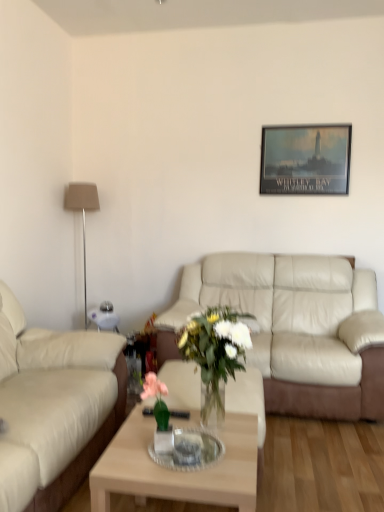
Question: Which direction should I rotate to look at beige leather couch at center, marked as the 1th studio couch in a right-to-left arrangement?

Choices:
 (A) right
 (B) left

Answer: (A)

Question: Is clear glass tray at center turned away from beige leather couch at left, which is counted as the first studio couch, starting from the front?

Choices:
 (A) no
 (B) yes

Answer: (B)

Question: Does clear glass tray at center have a larger size compared to beige leather couch at left, which is counted as the first studio couch, starting from the front?

Choices:
 (A) yes
 (B) no

Answer: (B)

Question: Does clear glass tray at center have a smaller size compared to beige leather couch at left, which is counted as the second studio couch, starting from the back?

Choices:
 (A) yes
 (B) no

Answer: (A)

Question: Is clear glass tray at center positioned before beige leather couch at left, the 1th studio couch from the left?

Choices:
 (A) no
 (B) yes

Answer: (A)

Question: Can you see clear glass tray at center touching beige leather couch at left, which is counted as the second studio couch, starting from the back?

Choices:
 (A) yes
 (B) no

Answer: (B)

Question: Is clear glass tray at center taller than beige leather couch at left, which is counted as the second studio couch, starting from the back?

Choices:
 (A) yes
 (B) no

Answer: (B)

Question: From the image's perspective, is clear glass tray at center under matte black poster at upper center?

Choices:
 (A) no
 (B) yes

Answer: (B)

Question: From a real-world perspective, is clear glass tray at center physically below matte black poster at upper center?

Choices:
 (A) no
 (B) yes

Answer: (B)

Question: Can you confirm if clear glass tray at center is bigger than matte black poster at upper center?

Choices:
 (A) no
 (B) yes

Answer: (A)

Question: Is matte black poster at upper center located within clear glass tray at center?

Choices:
 (A) yes
 (B) no

Answer: (B)

Question: Can you confirm if clear glass tray at center is thinner than matte black poster at upper center?

Choices:
 (A) no
 (B) yes

Answer: (A)

Question: Is clear glass tray at center placed right next to matte black poster at upper center?

Choices:
 (A) yes
 (B) no

Answer: (B)

Question: From a real-world perspective, is light wood/transparent glass coffee table at center physically above beige leather couch at center, marked as the 1th studio couch in a right-to-left arrangement?

Choices:
 (A) no
 (B) yes

Answer: (A)